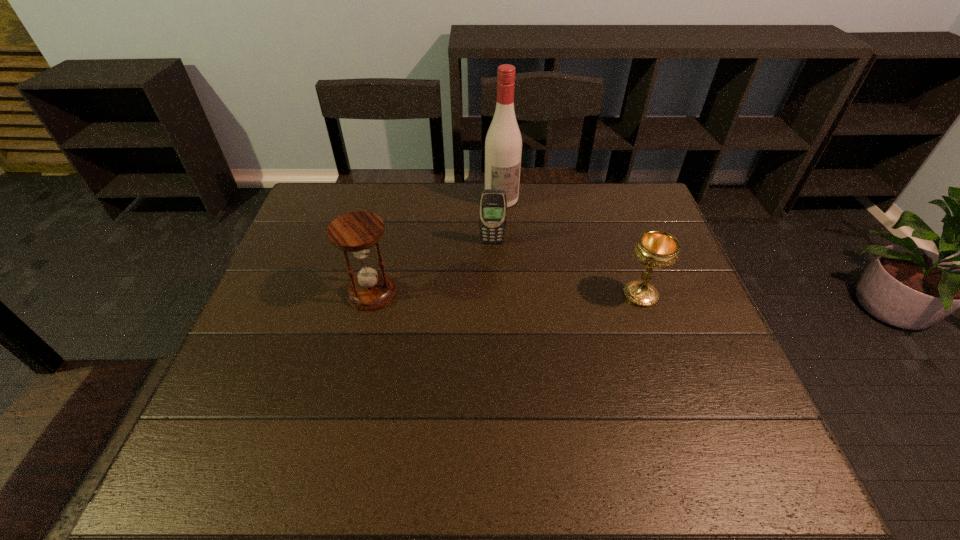
At what (x,y) coordinates should I click in order to perform the action: click on the leftmost object. Please return your answer as a coordinate pair (x, y). This screenshot has width=960, height=540. Looking at the image, I should click on (x=357, y=232).

Image resolution: width=960 pixels, height=540 pixels. Identify the location of the third shortest object. (357, 232).

Image resolution: width=960 pixels, height=540 pixels. I want to click on chalice, so pyautogui.click(x=656, y=249).

Where is `the farthest object`? the farthest object is located at coordinates (503, 145).

I want to click on alcohol, so click(503, 145).

Where is `the second farthest object`? The image size is (960, 540). the second farthest object is located at coordinates (493, 204).

Find the location of `vacant space positioned on the right of the hourglass`. vacant space positioned on the right of the hourglass is located at coordinates (530, 293).

Identify the location of vacant space situated on the left of the rightmost object. (529, 295).

The width and height of the screenshot is (960, 540). In order to click on free spot located 0.050m on the label of the farthest object in this screenshot , I will do `click(510, 218)`.

Identify the location of free space located 0.280m on the label of the farthest object. (530, 268).